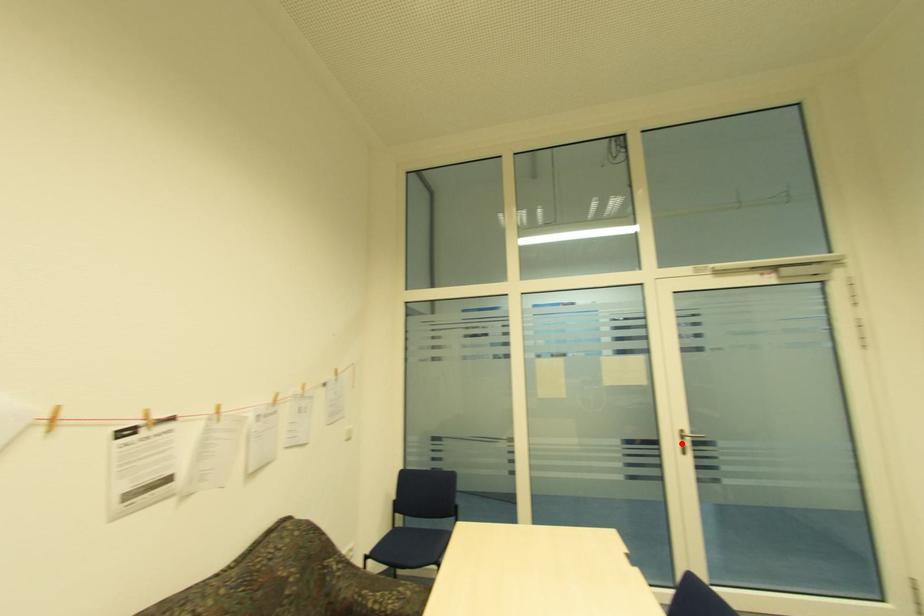
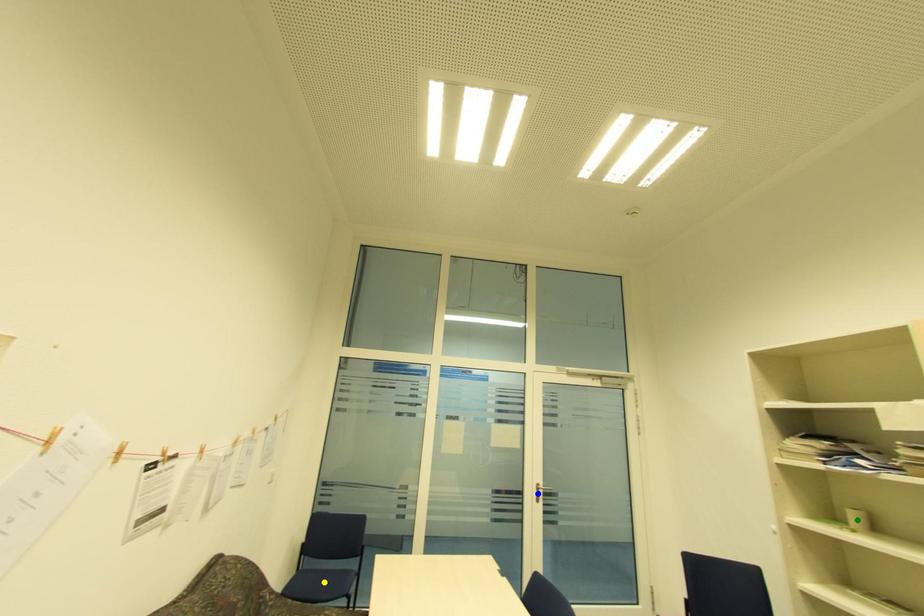
Question: I am providing you with two images of the same scene from different viewpoints. A red point is marked on the first image. You are given multiple points on the second image. In image 2, which mark is for the same physical point as the one in image 1?

Choices:
 (A) green point
 (B) blue point
 (C) yellow point

Answer: (B)